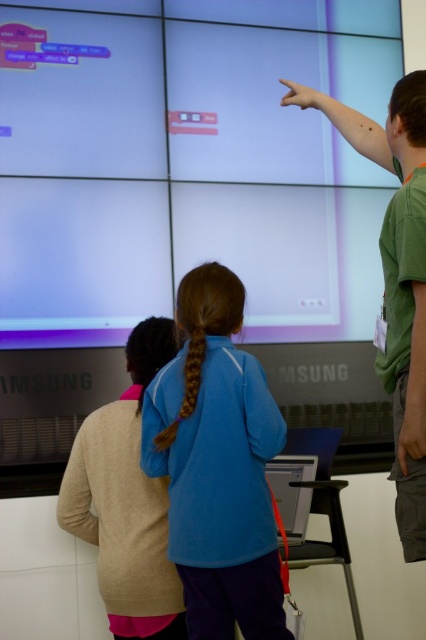
Question: Which of the following is the closest to the observer?

Choices:
 (A) matte white projection screen at upper center
 (B) matte black monitor at center

Answer: (B)

Question: Which object appears closest to the camera in this image?

Choices:
 (A) beige sweater at lower left
 (B) matte black monitor at center
 (C) blue fleece jacket at center
 (D) matte white projection screen at upper center

Answer: (C)

Question: Which of these objects is positioned closest to the matte white projection screen at upper center?

Choices:
 (A) beige sweater at lower left
 (B) blue fleece jacket at center
 (C) matte black monitor at center

Answer: (A)

Question: Is blue fleece jacket at center positioned at the back of matte black monitor at center?

Choices:
 (A) no
 (B) yes

Answer: (A)

Question: Does matte white projection screen at upper center have a lesser width compared to beige sweater at lower left?

Choices:
 (A) no
 (B) yes

Answer: (A)

Question: Considering the relative positions of blue fleece jacket at center and matte black monitor at center in the image provided, where is blue fleece jacket at center located with respect to matte black monitor at center?

Choices:
 (A) left
 (B) right

Answer: (A)